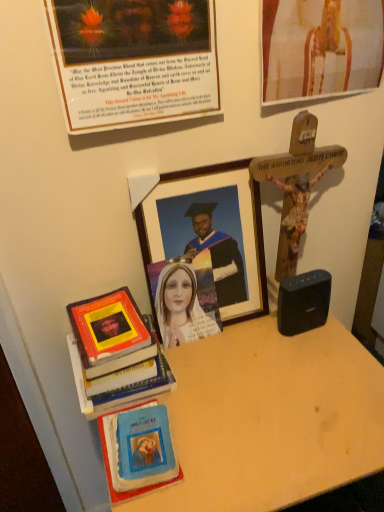
Question: Should I look upward or downward to see matte paper picture frame at upper left, which is the 2th picture frame in bottom-to-top order?

Choices:
 (A) down
 (B) up

Answer: (B)

Question: Is wooden picture frame at center, acting as the third picture frame starting from the top, positioned behind black plastic speaker at right?

Choices:
 (A) no
 (B) yes

Answer: (A)

Question: Is black plastic speaker at right located within wooden picture frame at center, which is the 1th picture frame from bottom to top?

Choices:
 (A) yes
 (B) no

Answer: (B)

Question: Is wooden picture frame at center, which is the 1th picture frame from bottom to top, to the left of black plastic speaker at right from the viewer's perspective?

Choices:
 (A) no
 (B) yes

Answer: (B)

Question: Is wooden picture frame at center, acting as the third picture frame starting from the top, bigger than black plastic speaker at right?

Choices:
 (A) yes
 (B) no

Answer: (A)

Question: Is wooden picture frame at center, which is the 1th picture frame from bottom to top, directly adjacent to black plastic speaker at right?

Choices:
 (A) yes
 (B) no

Answer: (B)

Question: From the image's perspective, would you say wooden picture frame at center, which is the 1th picture frame from bottom to top, is positioned over black plastic speaker at right?

Choices:
 (A) no
 (B) yes

Answer: (B)

Question: Is matte paper picture frame at upper left, which is the 2th picture frame in bottom-to-top order, located outside hardcover book at left, which appears as the second book when ordered from the bottom?

Choices:
 (A) yes
 (B) no

Answer: (A)

Question: Considering the relative sizes of matte paper picture frame at upper left, which is the 2th picture frame in top-to-bottom order, and hardcover book at left, which appears as the second book when ordered from the bottom, in the image provided, is matte paper picture frame at upper left, which is the 2th picture frame in top-to-bottom order, wider than hardcover book at left, which appears as the second book when ordered from the bottom,?

Choices:
 (A) yes
 (B) no

Answer: (B)

Question: Does matte paper picture frame at upper left, which is the 2th picture frame in top-to-bottom order, have a lesser width compared to hardcover book at left, which appears as the second book when ordered from the bottom?

Choices:
 (A) yes
 (B) no

Answer: (A)

Question: Is matte paper picture frame at upper left, which is the 2th picture frame in bottom-to-top order, positioned behind hardcover book at left, which appears as the second book when ordered from the bottom?

Choices:
 (A) no
 (B) yes

Answer: (A)

Question: Is matte paper picture frame at upper left, which is the 2th picture frame in bottom-to-top order, at the left side of hardcover book at left, arranged as the first book when viewed from the top?

Choices:
 (A) no
 (B) yes

Answer: (A)

Question: From the image's perspective, does matte paper picture frame at upper left, which is the 2th picture frame in bottom-to-top order, appear lower than hardcover book at left, which appears as the second book when ordered from the bottom?

Choices:
 (A) yes
 (B) no

Answer: (B)

Question: Is hardcover book at left, arranged as the first book when viewed from the top, outside wooden picture frame at center, which is the 1th picture frame from bottom to top?

Choices:
 (A) yes
 (B) no

Answer: (A)